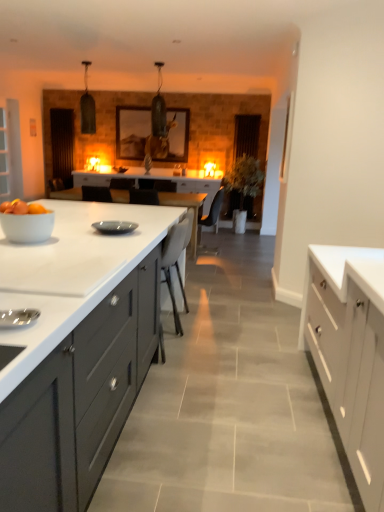
Question: Would you say transparent glass door at left, the 2th glass door positioned from the right, is part of white glossy table at center's contents?

Choices:
 (A) no
 (B) yes

Answer: (A)

Question: From the image's perspective, is white glossy table at center under transparent glass door at left, marked as the 1th glass door in a front-to-back arrangement?

Choices:
 (A) no
 (B) yes

Answer: (B)

Question: Is white glossy table at center thinner than transparent glass door at left, the 2th glass door positioned from the right?

Choices:
 (A) no
 (B) yes

Answer: (A)

Question: Can you confirm if white glossy table at center is shorter than transparent glass door at left, marked as the 1th glass door in a front-to-back arrangement?

Choices:
 (A) no
 (B) yes

Answer: (B)

Question: Does white glossy table at center have a smaller size compared to transparent glass door at left, the 2th glass door positioned from the right?

Choices:
 (A) yes
 (B) no

Answer: (B)

Question: From the image's perspective, relative to matte gray cabinets at center, the 2th cabinetry from the right, is white glossy bowl at left above or below?

Choices:
 (A) below
 (B) above

Answer: (B)

Question: Based on their positions, is white glossy bowl at left located to the left or right of matte gray cabinets at center, positioned as the 1th cabinetry in left-to-right order?

Choices:
 (A) left
 (B) right

Answer: (B)

Question: Is point (29, 219) closer or farther from the camera than point (110, 403)?

Choices:
 (A) closer
 (B) farther

Answer: (B)

Question: Considering the positions of white glossy bowl at left and matte gray cabinets at center, positioned as the 1th cabinetry in left-to-right order, in the image, is white glossy bowl at left taller or shorter than matte gray cabinets at center, positioned as the 1th cabinetry in left-to-right order,?

Choices:
 (A) short
 (B) tall

Answer: (A)

Question: Is matte gray plate at center to the left or to the right of transparent glass door at left, which is the first glass door from left to right, in the image?

Choices:
 (A) right
 (B) left

Answer: (A)

Question: Is point (124, 221) positioned closer to the camera than point (21, 162)?

Choices:
 (A) farther
 (B) closer

Answer: (B)

Question: In terms of height, does matte gray plate at center look taller or shorter compared to transparent glass door at left, which is the first glass door from left to right?

Choices:
 (A) short
 (B) tall

Answer: (A)

Question: Is matte gray plate at center spatially inside transparent glass door at left, which is the first glass door from left to right, or outside of it?

Choices:
 (A) outside
 (B) inside

Answer: (A)

Question: In the image, is white fabric chair at center on the left side or the right side of white wood cabinet at right, the 1th cabinetry from the right?

Choices:
 (A) left
 (B) right

Answer: (A)

Question: Considering the positions of point (173, 249) and point (332, 280), is point (173, 249) closer or farther from the camera than point (332, 280)?

Choices:
 (A) farther
 (B) closer

Answer: (A)